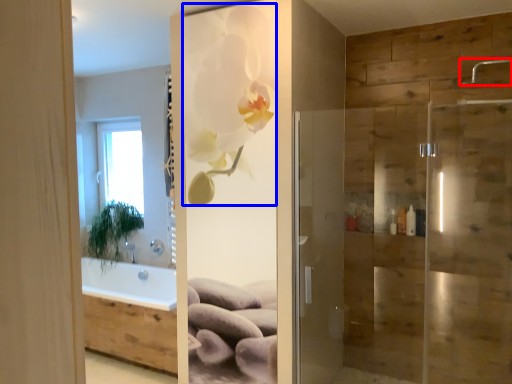
Question: Among these objects, which one is nearest to the camera, shower (highlighted by a red box) or floral arrangement (highlighted by a blue box)?

Choices:
 (A) shower
 (B) floral arrangement

Answer: (A)